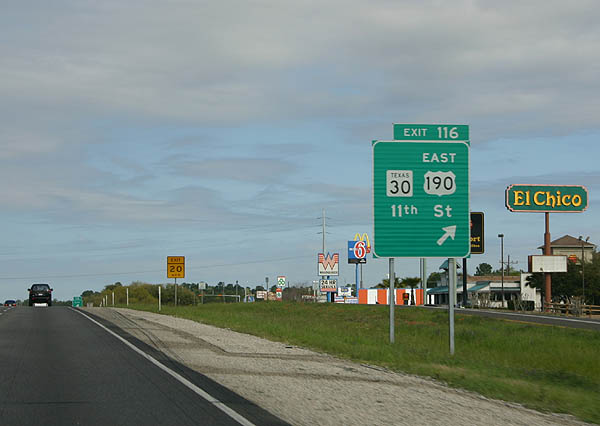
The height and width of the screenshot is (426, 600). What are the coordinates of `exit sign` in the screenshot? It's located at (422, 236), (78, 304).